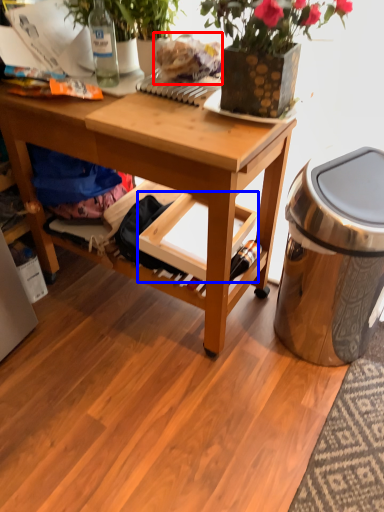
Question: Which object is further to the camera taking this photo, food (highlighted by a red box) or shelf (highlighted by a blue box)?

Choices:
 (A) food
 (B) shelf

Answer: (B)